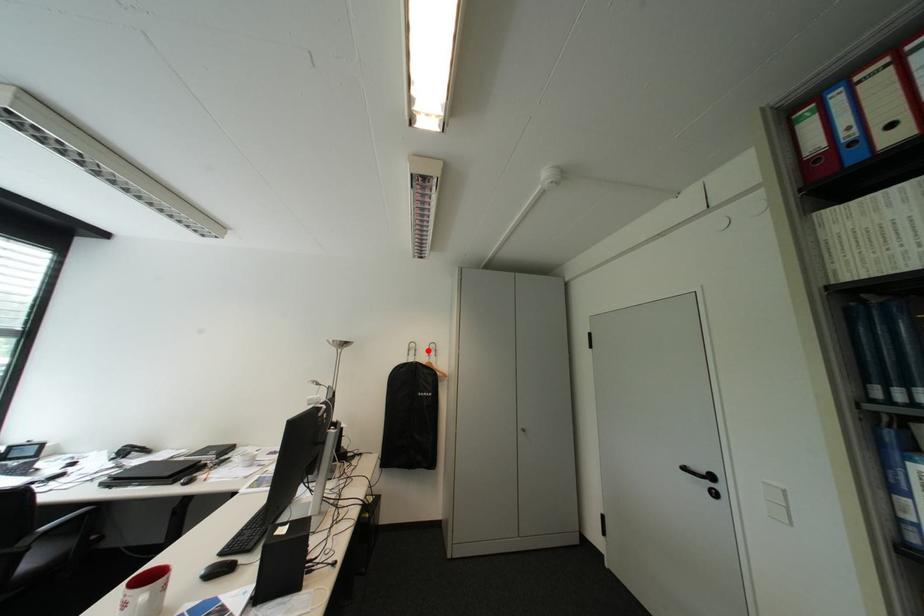
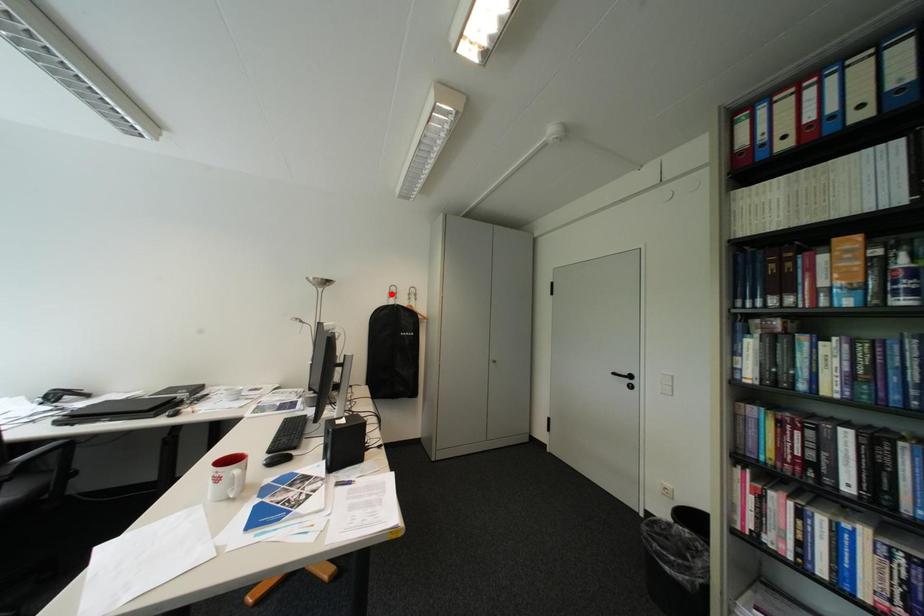
I am providing you with two images of the same scene from different viewpoints. A red point is marked on the first image and another point is marked on the second image. Is the red point in image1 aligned with the point shown in image2?

No